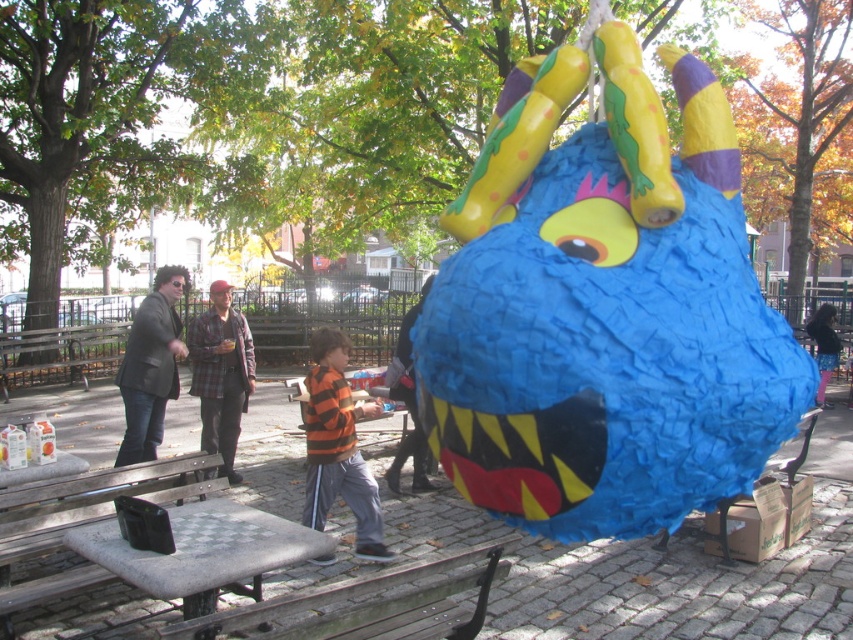
Based on the photo, you are at the park and want to sit down. You see a wooden bench at lower left and a plaid flannel shirt at center. Which object is smaller in size?

The wooden bench at lower left is smaller in size compared to the plaid flannel shirt at center.

You are standing in the park and want to hit the pi?ata with a stick. The pi?ata is at point (442,588). If you can throw the stick up to 10 feet, will you be able to reach the pi?ata?

The distance between you and point (442,588) is 8.79 feet, which is within your throwing range of 10 feet. Yes, you can reach the pi?ata.

You are a visitor in the park and want to sit down. You see the wooden bench at lower left and the orange striped hoodie at center. Which object is closer to the ground?

The wooden bench at lower left is closer to the ground since it is positioned below the orange striped hoodie at center.